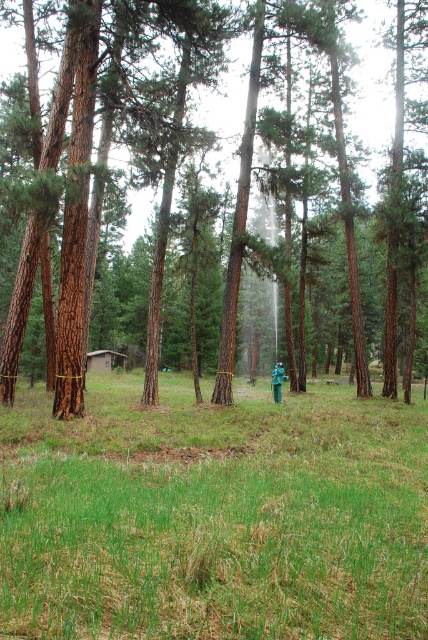
Question: From the image, what is the correct spatial relationship of green grass at center in relation to brown rough tree at center?

Choices:
 (A) left
 (B) right

Answer: (B)

Question: Observing the image, what is the correct spatial positioning of green grass at center in reference to brown rough tree at center?

Choices:
 (A) right
 (B) left

Answer: (A)

Question: Among these points, which one is farthest from the camera?

Choices:
 (A) (290, 176)
 (B) (365, 534)

Answer: (A)

Question: Can you confirm if green grass at center is positioned to the left of brown rough tree at center?

Choices:
 (A) yes
 (B) no

Answer: (B)